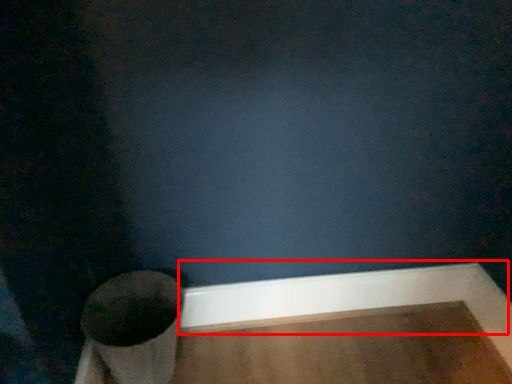
Question: From the image's perspective, considering the relative positions of molding (annotated by the red box) and toilet in the image provided, where is molding (annotated by the red box) located with respect to the staircase?

Choices:
 (A) below
 (B) above

Answer: (B)